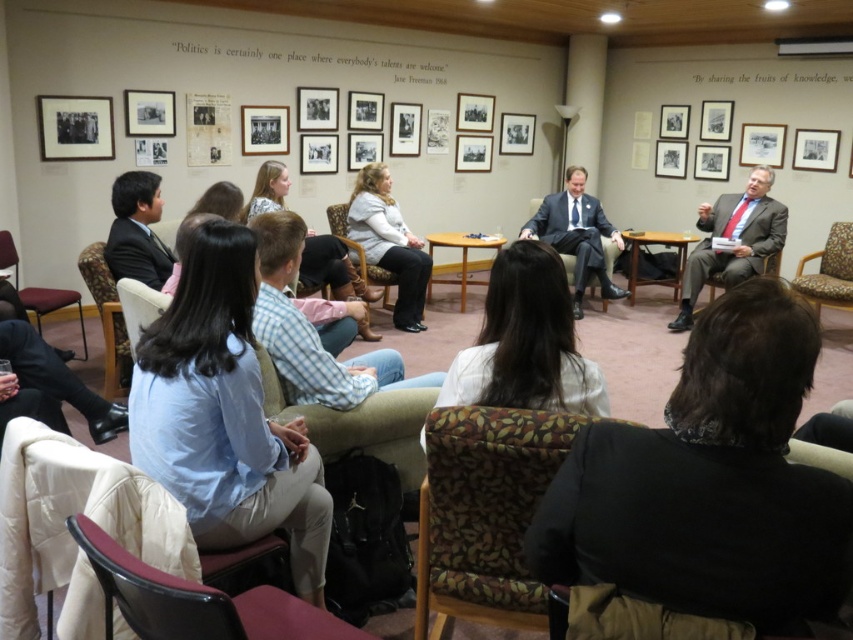
You are standing in the conference room and want to move from the point closer to the front of the room to the point further back. Which path should you take between the two points, point (828, 305) and point (479, 237)?

You should move from point (828, 305) to point (479, 237) because point (828, 305) is closer to the viewer and thus the path goes towards the back of the room.

You are a photographer standing at the camera position. You want to take a closeup photo of the light gray sweater at center. Can you reach it with your 50mm lens without moving your position?

The light gray sweater at center is 5.75 meters away from camera. A 50mm lens has a standard field of view, so at 5.75 meters, it would not allow a closeup without moving closer. You need a telephoto lens for a closer shot.

You are an attendee at the conference. You notice the light gray sweater at center and the patterned fabric armchair at right. Which object is higher in the image?

The light gray sweater at center is above the patterned fabric armchair at right, so it is higher in the image.